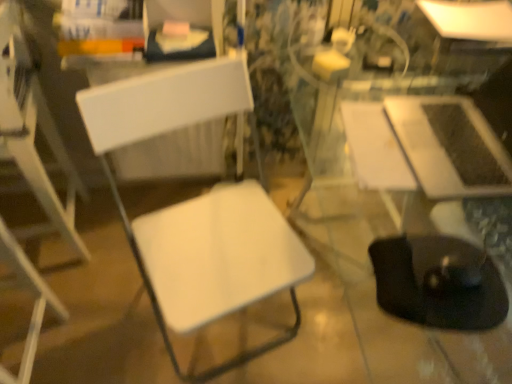
The height and width of the screenshot is (384, 512). In order to click on free space that is to the left of satin silver laptop at right, the first table from the bottom in this screenshot , I will do `click(371, 135)`.